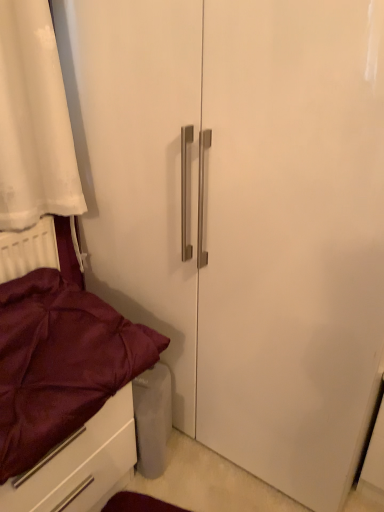
Question: From a real-world perspective, is satin burgundy drawer at lower left physically below maroon satin bed at lower left?

Choices:
 (A) no
 (B) yes

Answer: (B)

Question: Can you confirm if satin burgundy drawer at lower left is bigger than maroon satin bed at lower left?

Choices:
 (A) no
 (B) yes

Answer: (B)

Question: From the image's perspective, is satin burgundy drawer at lower left above maroon satin bed at lower left?

Choices:
 (A) yes
 (B) no

Answer: (B)

Question: Are satin burgundy drawer at lower left and maroon satin bed at lower left beside each other?

Choices:
 (A) no
 (B) yes

Answer: (B)

Question: Is satin burgundy drawer at lower left wider than maroon satin bed at lower left?

Choices:
 (A) no
 (B) yes

Answer: (A)

Question: Is satin burgundy drawer at lower left to the left of maroon satin bed at lower left from the viewer's perspective?

Choices:
 (A) no
 (B) yes

Answer: (B)

Question: From a real-world perspective, is maroon satin bed at lower left positioned under satin burgundy drawer at lower left based on gravity?

Choices:
 (A) yes
 (B) no

Answer: (B)

Question: From a real-world perspective, is maroon satin bed at lower left positioned over satin burgundy drawer at lower left based on gravity?

Choices:
 (A) yes
 (B) no

Answer: (A)

Question: Is the surface of maroon satin bed at lower left in direct contact with satin burgundy drawer at lower left?

Choices:
 (A) no
 (B) yes

Answer: (B)

Question: From the image's perspective, is maroon satin bed at lower left located above satin burgundy drawer at lower left?

Choices:
 (A) no
 (B) yes

Answer: (B)

Question: Is maroon satin bed at lower left smaller than satin burgundy drawer at lower left?

Choices:
 (A) yes
 (B) no

Answer: (A)

Question: Can you confirm if maroon satin bed at lower left is shorter than satin burgundy drawer at lower left?

Choices:
 (A) yes
 (B) no

Answer: (A)

Question: Considering the positions of satin burgundy drawer at lower left and maroon satin bed at lower left in the image, is satin burgundy drawer at lower left bigger or smaller than maroon satin bed at lower left?

Choices:
 (A) big
 (B) small

Answer: (A)